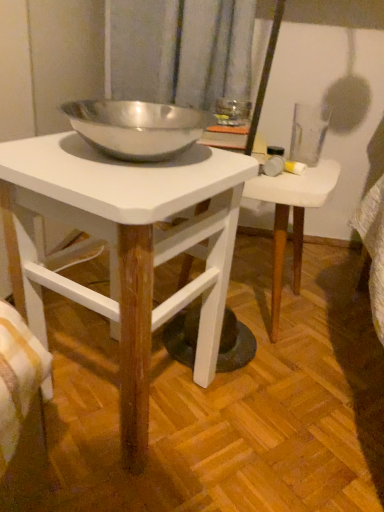
What is the approximate width of white matte table at center, which is counted as the 2th table, starting from the back?

white matte table at center, which is counted as the 2th table, starting from the back, is 12.73 inches wide.

What do you see at coordinates (125, 248) in the screenshot? I see `white matte table at center, which is counted as the 2th table, starting from the back` at bounding box center [125, 248].

The height and width of the screenshot is (512, 384). I want to click on white matte table at center, which is counted as the 2th table, starting from the back, so click(125, 248).

What do you see at coordinates (293, 218) in the screenshot?
I see `white wood table at center, which is the first table in back-to-front order` at bounding box center [293, 218].

Image resolution: width=384 pixels, height=512 pixels. I want to click on white wood table at center, positioned as the second table in front-to-back order, so click(293, 218).

At what (x,y) coordinates should I click in order to perform the action: click on white matte table at center, which is the first table from front to back. Please return your answer as a coordinate pair (x, y). The image size is (384, 512). Looking at the image, I should click on (125, 248).

Is white matte table at center, which is the first table from front to back, at the left side of white wood table at center, positioned as the second table in front-to-back order?

Indeed, white matte table at center, which is the first table from front to back, is positioned on the left side of white wood table at center, positioned as the second table in front-to-back order.

Between white matte table at center, which is counted as the 2th table, starting from the back, and white wood table at center, which is the first table in back-to-front order, which one is positioned behind?

Positioned behind is white wood table at center, which is the first table in back-to-front order.

Is point (146, 325) closer to camera compared to point (273, 281)?

Yes, it is.

From the image's perspective, does white matte table at center, which is counted as the 2th table, starting from the back, appear higher than white wood table at center, positioned as the second table in front-to-back order?

No.

From a real-world perspective, is white matte table at center, which is the first table from front to back, positioned under white wood table at center, which is the first table in back-to-front order, based on gravity?

No, from a real-world perspective, white matte table at center, which is the first table from front to back, is not below white wood table at center, which is the first table in back-to-front order.

Is white matte table at center, which is counted as the 2th table, starting from the back, wider or thinner than white wood table at center, positioned as the second table in front-to-back order?

Clearly, white matte table at center, which is counted as the 2th table, starting from the back, has more width compared to white wood table at center, positioned as the second table in front-to-back order.

Consider the image. Can you confirm if white matte table at center, which is counted as the 2th table, starting from the back, is shorter than white wood table at center, which is the first table in back-to-front order?

In fact, white matte table at center, which is counted as the 2th table, starting from the back, may be taller than white wood table at center, which is the first table in back-to-front order.

Considering the relative sizes of white matte table at center, which is counted as the 2th table, starting from the back, and white wood table at center, which is the first table in back-to-front order, in the image provided, is white matte table at center, which is counted as the 2th table, starting from the back, bigger than white wood table at center, which is the first table in back-to-front order,?

Indeed, white matte table at center, which is counted as the 2th table, starting from the back, has a larger size compared to white wood table at center, which is the first table in back-to-front order.

Is white matte table at center, which is counted as the 2th table, starting from the back, situated inside white wood table at center, which is the first table in back-to-front order, or outside?

white matte table at center, which is counted as the 2th table, starting from the back, is outside white wood table at center, which is the first table in back-to-front order.

Is white matte table at center, which is the first table from front to back, far away from white wood table at center, which is the first table in back-to-front order?

No, there isn't a large distance between white matte table at center, which is the first table from front to back, and white wood table at center, which is the first table in back-to-front order.

Is white matte table at center, which is counted as the 2th table, starting from the back, aimed at white wood table at center, positioned as the second table in front-to-back order?

No, white matte table at center, which is counted as the 2th table, starting from the back, is not oriented towards white wood table at center, positioned as the second table in front-to-back order.

Could you measure the distance between white matte table at center, which is counted as the 2th table, starting from the back, and white wood table at center, positioned as the second table in front-to-back order?

8.50 inches.

At what (x,y) coordinates should I click in order to perform the action: click on table in front of the white wood table at center, which is the first table in back-to-front order. Please return your answer as a coordinate pair (x, y). The height and width of the screenshot is (512, 384). Looking at the image, I should click on (125, 248).

Considering the positions of objects white wood table at center, positioned as the second table in front-to-back order, and white matte table at center, which is counted as the 2th table, starting from the back, in the image provided, who is more to the left, white wood table at center, positioned as the second table in front-to-back order, or white matte table at center, which is counted as the 2th table, starting from the back,?

white matte table at center, which is counted as the 2th table, starting from the back.

Between white wood table at center, positioned as the second table in front-to-back order, and white matte table at center, which is the first table from front to back, which one is positioned in front?

white matte table at center, which is the first table from front to back, is more forward.

Which is behind, point (267, 187) or point (63, 164)?

The point (267, 187) is more distant.

From the image's perspective, is white wood table at center, positioned as the second table in front-to-back order, above or below white matte table at center, which is counted as the 2th table, starting from the back?

Based on their image positions, white wood table at center, positioned as the second table in front-to-back order, is located above white matte table at center, which is counted as the 2th table, starting from the back.

From a real-world perspective, is white wood table at center, which is the first table in back-to-front order, below white matte table at center, which is the first table from front to back?

Yes, from a real-world perspective, white wood table at center, which is the first table in back-to-front order, is under white matte table at center, which is the first table from front to back.

Looking at this image, which of these two, white wood table at center, which is the first table in back-to-front order, or white matte table at center, which is the first table from front to back, is thinner?

With smaller width is white wood table at center, which is the first table in back-to-front order.

Based on the photo, which of these two, white wood table at center, which is the first table in back-to-front order, or white matte table at center, which is counted as the 2th table, starting from the back, stands taller?

white matte table at center, which is counted as the 2th table, starting from the back, is taller.

In terms of size, does white wood table at center, positioned as the second table in front-to-back order, appear bigger or smaller than white matte table at center, which is counted as the 2th table, starting from the back?

white wood table at center, positioned as the second table in front-to-back order, is smaller than white matte table at center, which is counted as the 2th table, starting from the back.

Looking at this image, which is correct: white wood table at center, which is the first table in back-to-front order, is inside white matte table at center, which is the first table from front to back, or outside of it?

white wood table at center, which is the first table in back-to-front order, is not enclosed by white matte table at center, which is the first table from front to back.

Is white wood table at center, which is the first table in back-to-front order, in contact with white matte table at center, which is the first table from front to back?

There is a gap between white wood table at center, which is the first table in back-to-front order, and white matte table at center, which is the first table from front to back.

Is white wood table at center, which is the first table in back-to-front order, facing away from white matte table at center, which is counted as the 2th table, starting from the back?

No, white wood table at center, which is the first table in back-to-front order, is not facing the opposite direction of white matte table at center, which is counted as the 2th table, starting from the back.

The width and height of the screenshot is (384, 512). Find the location of `table lying above the white matte table at center, which is counted as the 2th table, starting from the back (from the image's perspective)`. table lying above the white matte table at center, which is counted as the 2th table, starting from the back (from the image's perspective) is located at coordinates (293, 218).

Identify the location of table on the right of white matte table at center, which is the first table from front to back. The image size is (384, 512). (293, 218).

Locate an element on the screen. The image size is (384, 512). table that is below the white wood table at center, positioned as the second table in front-to-back order (from the image's perspective) is located at coordinates 125,248.